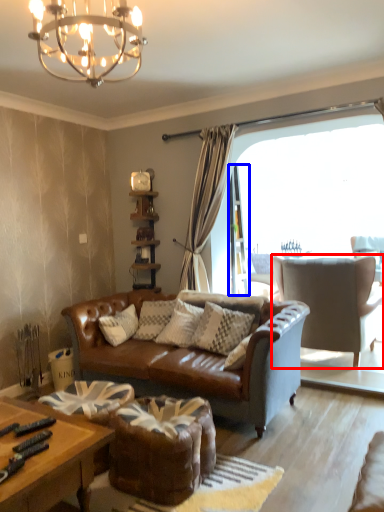
Question: Which object appears farthest to the camera in this image, chair (highlighted by a red box) or screen door (highlighted by a blue box)?

Choices:
 (A) chair
 (B) screen door

Answer: (B)